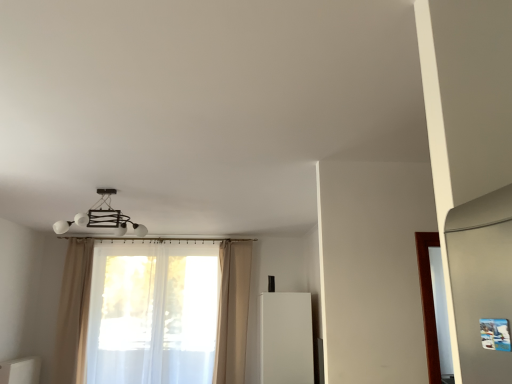
Question: Would you consider beige fabric curtain at left, the 1th curtain in the left-to-right sequence, to be distant from translucent white curtain at center, acting as the second curtain starting from the left?

Choices:
 (A) no
 (B) yes

Answer: (A)

Question: From a real-world perspective, is beige fabric curtain at left, which is the third curtain in right-to-left order, on top of translucent white curtain at center, which ranks as the 2th curtain in right-to-left order?

Choices:
 (A) no
 (B) yes

Answer: (B)

Question: Considering the relative sizes of beige fabric curtain at left, which is the third curtain in right-to-left order, and translucent white curtain at center, acting as the second curtain starting from the left, in the image provided, is beige fabric curtain at left, which is the third curtain in right-to-left order, thinner than translucent white curtain at center, acting as the second curtain starting from the left,?

Choices:
 (A) no
 (B) yes

Answer: (B)

Question: Does beige fabric curtain at left, the 1th curtain in the left-to-right sequence, turn towards translucent white curtain at center, acting as the second curtain starting from the left?

Choices:
 (A) yes
 (B) no

Answer: (B)

Question: Can you confirm if beige fabric curtain at left, which is the third curtain in right-to-left order, is positioned to the left of translucent white curtain at center, which ranks as the 2th curtain in right-to-left order?

Choices:
 (A) yes
 (B) no

Answer: (A)

Question: In the image, is matte white chandelier at upper center on the left side or the right side of white matte refrigerator at center?

Choices:
 (A) left
 (B) right

Answer: (A)

Question: Relative to white matte refrigerator at center, is matte white chandelier at upper center in front or behind?

Choices:
 (A) behind
 (B) front

Answer: (B)

Question: From their relative heights in the image, would you say matte white chandelier at upper center is taller or shorter than white matte refrigerator at center?

Choices:
 (A) tall
 (B) short

Answer: (B)

Question: Do you think matte white chandelier at upper center is within white matte refrigerator at center, or outside of it?

Choices:
 (A) inside
 (B) outside

Answer: (B)

Question: Looking at the image, does white glossy cabinet at lower left seem bigger or smaller compared to beige fabric curtain at center, which is the first curtain from right to left?

Choices:
 (A) small
 (B) big

Answer: (A)

Question: Considering the positions of white glossy cabinet at lower left and beige fabric curtain at center, which is the first curtain from right to left, in the image, is white glossy cabinet at lower left wider or thinner than beige fabric curtain at center, which is the first curtain from right to left,?

Choices:
 (A) thin
 (B) wide

Answer: (B)

Question: From the image's perspective, is white glossy cabinet at lower left above or below beige fabric curtain at center, which is the first curtain from right to left?

Choices:
 (A) above
 (B) below

Answer: (B)

Question: In terms of height, does white glossy cabinet at lower left look taller or shorter compared to beige fabric curtain at center, acting as the third curtain starting from the left?

Choices:
 (A) tall
 (B) short

Answer: (B)

Question: Relative to white matte refrigerator at center, is beige fabric curtain at center, acting as the third curtain starting from the left, in front or behind?

Choices:
 (A) behind
 (B) front

Answer: (A)

Question: From a real-world perspective, relative to white matte refrigerator at center, is beige fabric curtain at center, which is the first curtain from right to left, vertically above or below?

Choices:
 (A) above
 (B) below

Answer: (A)